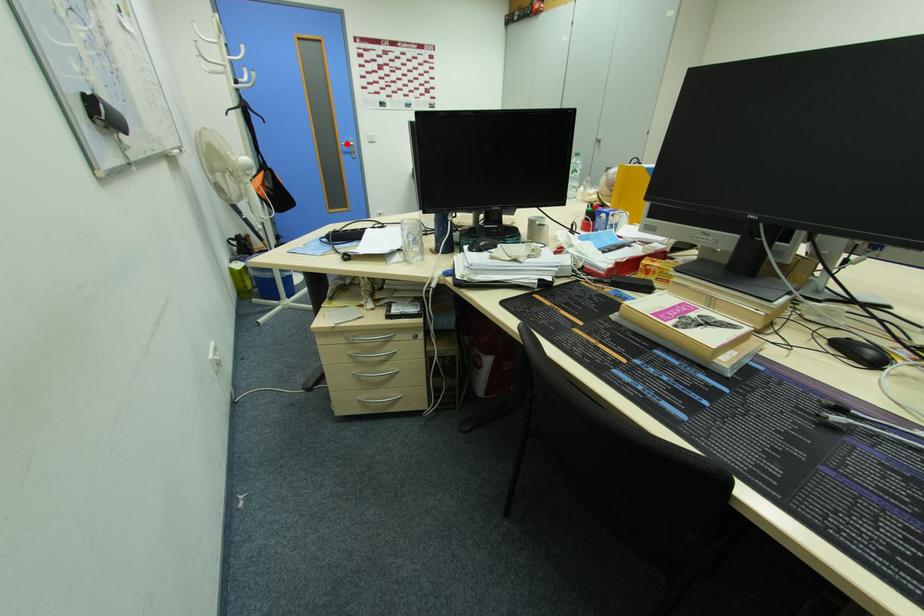
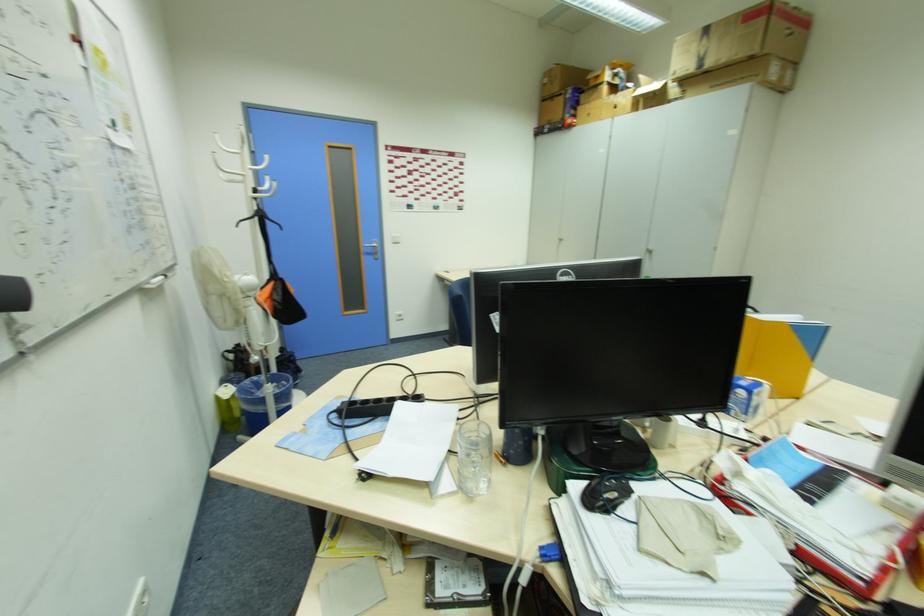
Locate, in the second image, the point that corresponds to the highlighted location in the first image.

(370, 245)